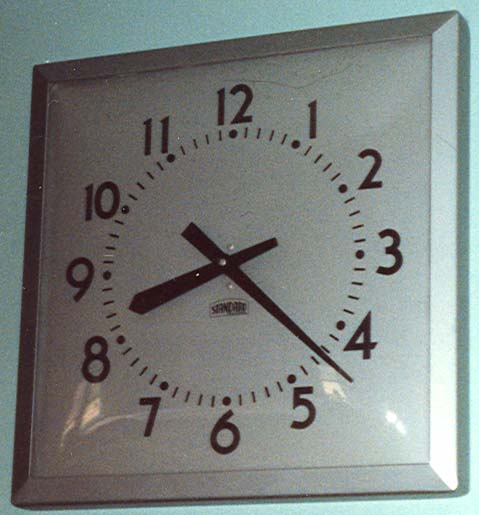
The image size is (479, 515). In order to click on hour hand of clock in this screenshot , I will do `click(153, 298)`.